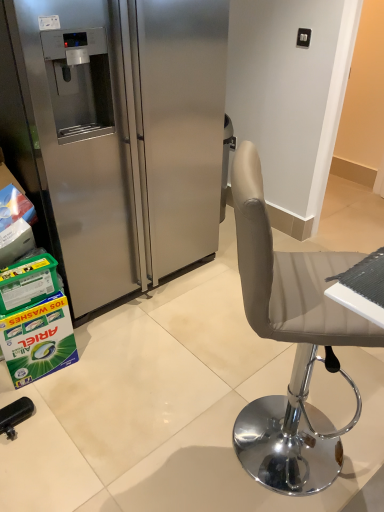
Question: Can you confirm if green plastic container at lower left, the second box in the bottom-to-top sequence, is positioned to the right of green cardboard box at lower left, the first box when ordered from bottom to top?

Choices:
 (A) yes
 (B) no

Answer: (A)

Question: From a real-world perspective, is green plastic container at lower left, the first box positioned from the top, positioned under green cardboard box at lower left, which ranks as the second box in top-to-bottom order, based on gravity?

Choices:
 (A) no
 (B) yes

Answer: (A)

Question: Would you say green plastic container at lower left, the second box in the bottom-to-top sequence, contains green cardboard box at lower left, which ranks as the second box in top-to-bottom order?

Choices:
 (A) yes
 (B) no

Answer: (B)

Question: Is green plastic container at lower left, the first box positioned from the top, bigger than green cardboard box at lower left, the first box when ordered from bottom to top?

Choices:
 (A) no
 (B) yes

Answer: (A)

Question: Is green plastic container at lower left, the first box positioned from the top, not close to green cardboard box at lower left, which ranks as the second box in top-to-bottom order?

Choices:
 (A) no
 (B) yes

Answer: (A)

Question: Considering the positions of green plastic container at lower left, the first box positioned from the top, and green cardboard box at lower left, which ranks as the second box in top-to-bottom order, in the image, is green plastic container at lower left, the first box positioned from the top, wider or thinner than green cardboard box at lower left, which ranks as the second box in top-to-bottom order,?

Choices:
 (A) thin
 (B) wide

Answer: (B)

Question: Is point (44, 285) closer or farther from the camera than point (13, 346)?

Choices:
 (A) closer
 (B) farther

Answer: (A)

Question: Is green plastic container at lower left, the second box in the bottom-to-top sequence, taller or shorter than green cardboard box at lower left, the first box when ordered from bottom to top?

Choices:
 (A) tall
 (B) short

Answer: (B)

Question: Is green plastic container at lower left, the first box positioned from the top, inside the boundaries of green cardboard box at lower left, the first box when ordered from bottom to top, or outside?

Choices:
 (A) outside
 (B) inside

Answer: (A)

Question: Would you say green plastic container at lower left, the second box in the bottom-to-top sequence, is to the left or to the right of stainless steel refrigerator at left in the picture?

Choices:
 (A) left
 (B) right

Answer: (A)

Question: In terms of width, does green plastic container at lower left, the second box in the bottom-to-top sequence, look wider or thinner when compared to stainless steel refrigerator at left?

Choices:
 (A) wide
 (B) thin

Answer: (B)

Question: Relative to stainless steel refrigerator at left, is green plastic container at lower left, the first box positioned from the top, in front or behind?

Choices:
 (A) front
 (B) behind

Answer: (B)

Question: Is point (3, 312) closer or farther from the camera than point (210, 47)?

Choices:
 (A) farther
 (B) closer

Answer: (B)

Question: Does point (148, 223) appear closer or farther from the camera than point (23, 282)?

Choices:
 (A) closer
 (B) farther

Answer: (B)

Question: In terms of size, does stainless steel refrigerator at left appear bigger or smaller than green plastic container at lower left, the first box positioned from the top?

Choices:
 (A) small
 (B) big

Answer: (B)